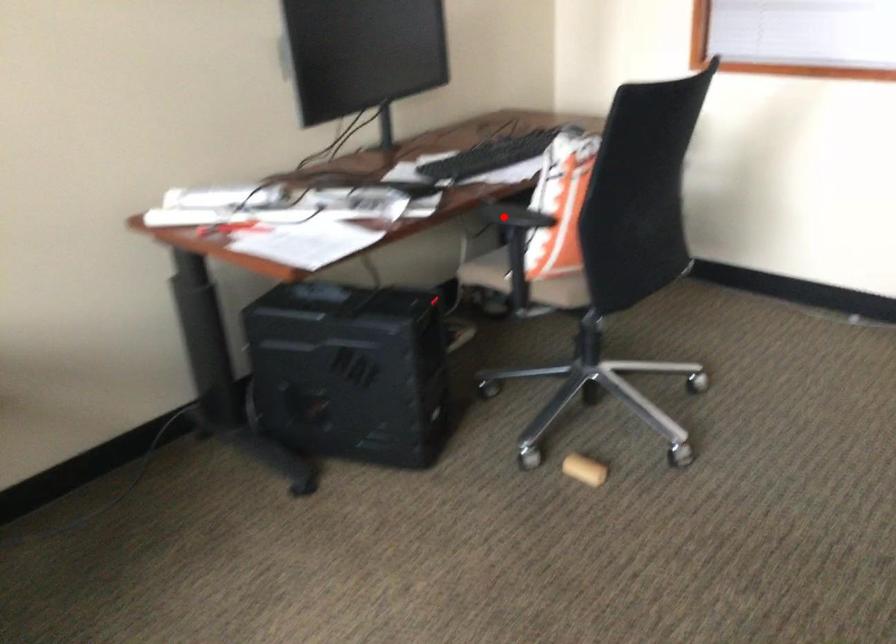
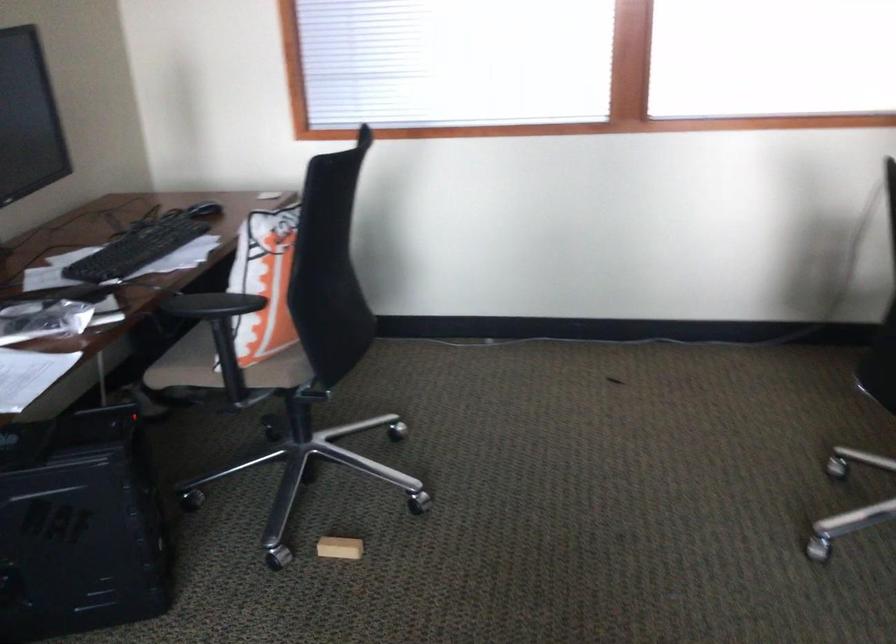
Find the pixel in the second image that matches the highlighted location in the first image.

(211, 305)